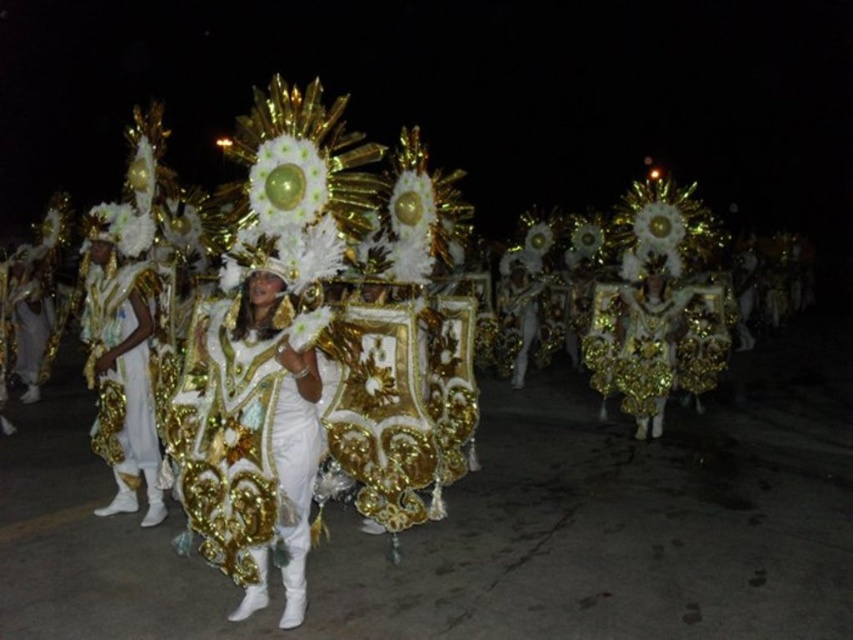
You are a photographer at the carnival trying to capture a photo of the white satin headdress at center and the gold sequined costume at center. Which object should you focus on first if you want to ensure both are in frame without moving the camera?

You should focus on the gold sequined costume at center first because it is taller than the white satin headdress at center, so adjusting the framing to accommodate its height will naturally include the shorter headdress within the shot.

You are a photographer at the carnival event. You want to capture a closeup shot of the white satin costume at center and the white satin headdress at center. Which object should you focus on if you want to fill the frame more?

The white satin costume at center is bigger than the white satin headdress at center, so focusing on the white satin costume at center will fill the frame more.

You are a photographer at the carnival, and you want to capture both the white satin costume at center and the white satin headdress at center in a single frame. Which object should you focus on first to ensure both are in the frame?

The white satin costume at center is not as tall as the white satin headdress at center, so you should focus on the white satin headdress at center first to ensure both are in the frame.